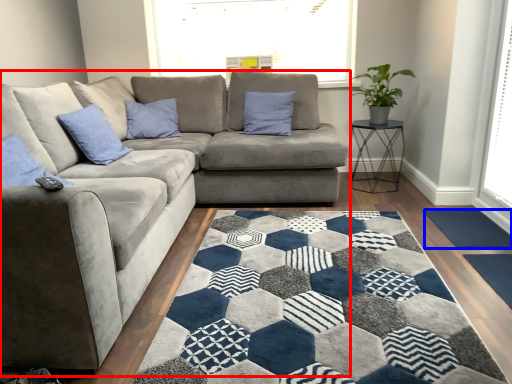
Question: Which point is closer to the camera, studio couch (highlighted by a red box) or doormat (highlighted by a blue box)?

Choices:
 (A) studio couch
 (B) doormat

Answer: (A)